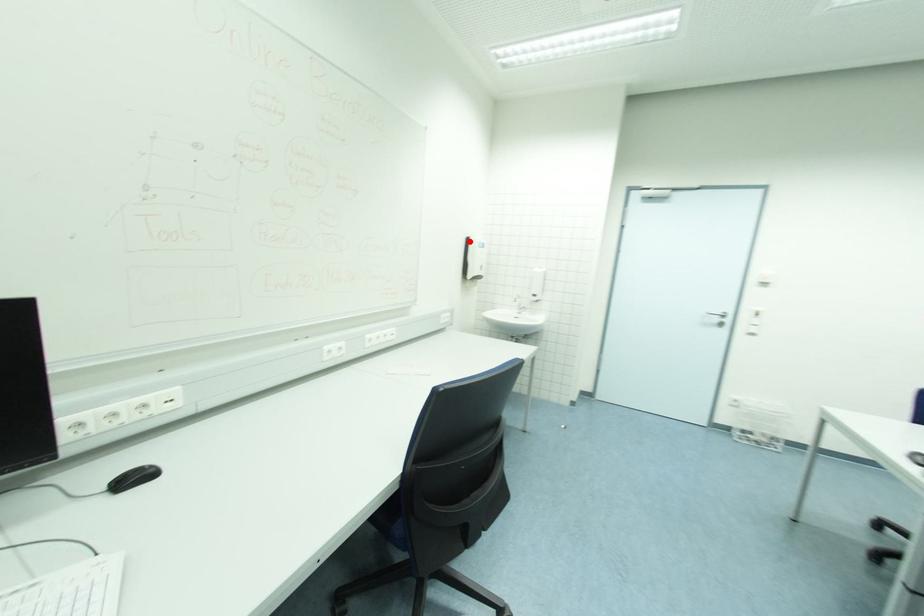
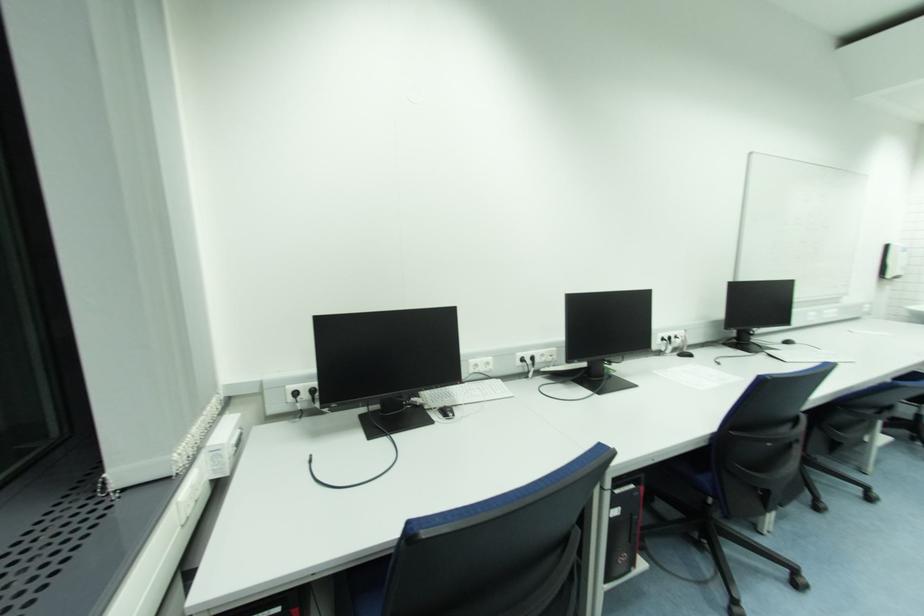
Question: A red point is marked in image1. In image2, is the corresponding 3D point closer to the camera or farther? Reply with the corresponding letter.

Choices:
 (A) The corresponding 3D point is closer.
 (B) The corresponding 3D point is farther.

Answer: (B)